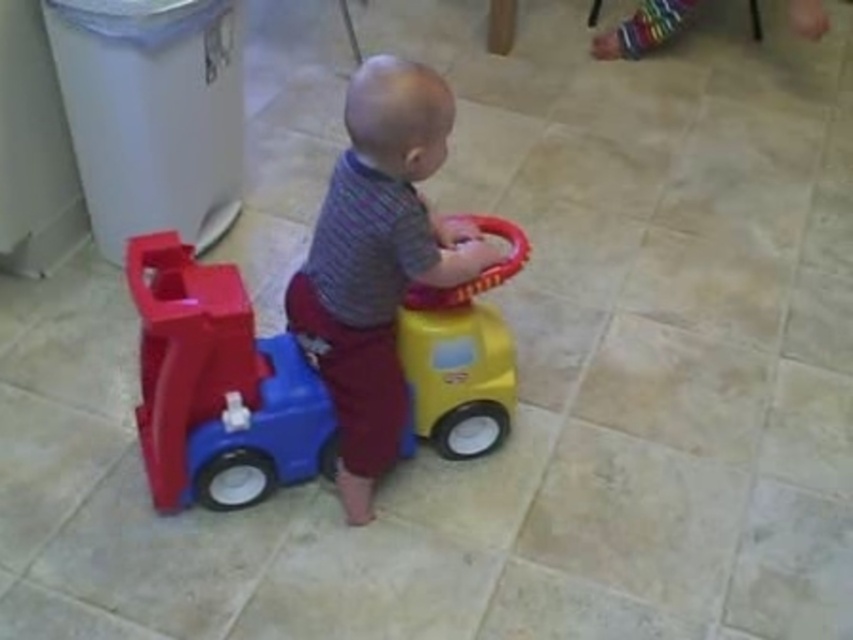
In the scene shown: The child is standing on two cars, the matte plastic car at center and the matte plastic toy car at center. Which one is wider?

The matte plastic car at center is wider than the matte plastic toy car at center according to the description.

You are a parent trying to decide which toy to give your child to play with. You see the matte plastic car at center and the matte plastic toy car at center. Which one is bigger?

The matte plastic car at center is larger in size compared to the matte plastic toy car at center.